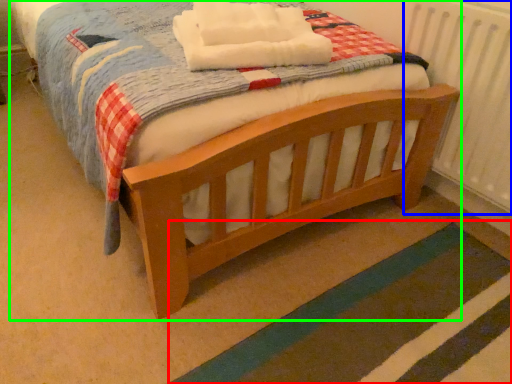
Question: Which object is the farthest from strip (highlighted by a red box)? Choose among these: radiator (highlighted by a blue box) or bed (highlighted by a green box).

Choices:
 (A) radiator
 (B) bed

Answer: (A)